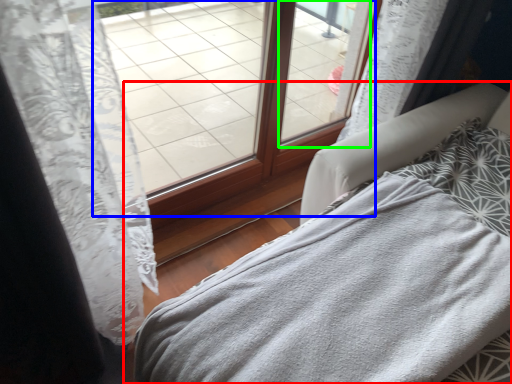
Question: Which object is positioned closest to furniture (highlighted by a red box)? Select from window (highlighted by a blue box) and window (highlighted by a green box).

Choices:
 (A) window
 (B) window

Answer: (A)